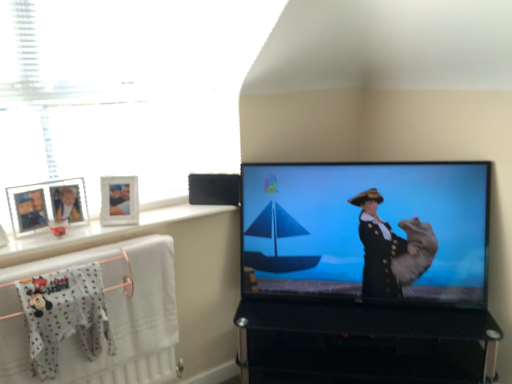
Where is `empty space that is ontop of white glossy window sill at upper left (from a real-world perspective)`? The width and height of the screenshot is (512, 384). empty space that is ontop of white glossy window sill at upper left (from a real-world perspective) is located at coordinates (120, 223).